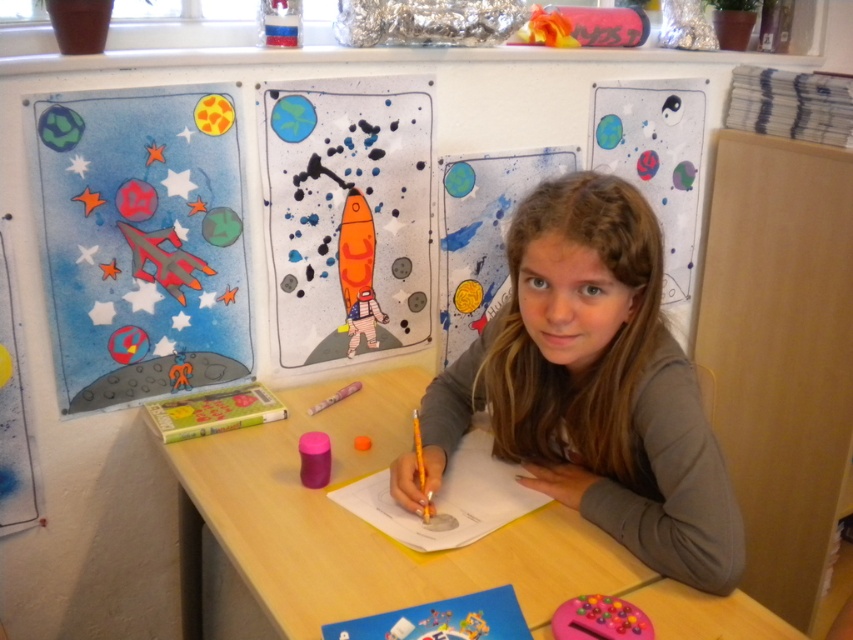
Question: Among these objects, which one is nearest to the camera?

Choices:
 (A) wooden table at center
 (B) smooth brown hair at center
 (C) orange matte pencil at center

Answer: (A)

Question: Is wooden table at center to the left of orange matte pencil at center from the viewer's perspective?

Choices:
 (A) no
 (B) yes

Answer: (A)

Question: Based on their relative distances, which object is nearer to the smooth brown hair at center?

Choices:
 (A) wooden table at center
 (B) orange matte pencil at center

Answer: (A)

Question: Can you confirm if smooth brown hair at center is wider than orange matte pencil at center?

Choices:
 (A) yes
 (B) no

Answer: (A)

Question: Is smooth brown hair at center thinner than orange matte pencil at center?

Choices:
 (A) no
 (B) yes

Answer: (A)

Question: Which is nearer to the smooth brown hair at center?

Choices:
 (A) wooden table at center
 (B) orange matte pencil at center

Answer: (A)